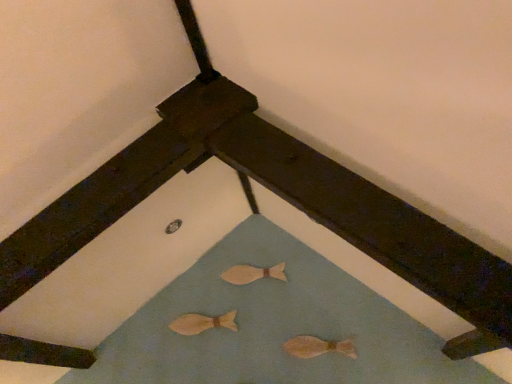
Question: Can you confirm if wooden fish at center, the 1th animal when ordered from left to right, is thinner than wooden fish at center, acting as the third animal starting from the bottom?

Choices:
 (A) yes
 (B) no

Answer: (B)

Question: Could you tell me if wooden fish at center, the second animal positioned from the back, is turned towards wooden fish at center, the 1th animal from the back?

Choices:
 (A) no
 (B) yes

Answer: (A)

Question: From a real-world perspective, is wooden fish at center, arranged as the second animal when viewed from the top, on top of wooden fish at center, placed as the 1th animal when sorted from top to bottom?

Choices:
 (A) no
 (B) yes

Answer: (A)

Question: Does wooden fish at center, which is counted as the third animal, starting from the right, have a greater height compared to wooden fish at center, acting as the third animal starting from the bottom?

Choices:
 (A) no
 (B) yes

Answer: (B)

Question: From the image's perspective, is wooden fish at center, the second animal positioned from the back, on wooden fish at center, which is the 2th animal from left to right?

Choices:
 (A) no
 (B) yes

Answer: (A)

Question: Does point (273, 274) appear closer or farther from the camera than point (181, 319)?

Choices:
 (A) closer
 (B) farther

Answer: (B)

Question: From a real-world perspective, is wooden fish at center, placed as the 1th animal when sorted from top to bottom, above or below wooden fish at center, which is counted as the third animal, starting from the right?

Choices:
 (A) below
 (B) above

Answer: (B)

Question: Considering the positions of wooden fish at center, placed as the 1th animal when sorted from top to bottom, and wooden fish at center, the 2th animal positioned from the bottom, in the image, is wooden fish at center, placed as the 1th animal when sorted from top to bottom, wider or thinner than wooden fish at center, the 2th animal positioned from the bottom,?

Choices:
 (A) thin
 (B) wide

Answer: (A)

Question: Looking at the image, does wooden fish at center, acting as the third animal starting from the front, seem bigger or smaller compared to wooden fish at center, the 1th animal when ordered from left to right?

Choices:
 (A) small
 (B) big

Answer: (A)

Question: Looking at their shapes, would you say wooden fish at center, which is the 2th animal from left to right, is wider or thinner than light brown wooden fish at lower center, which appears as the first animal when ordered from the bottom?

Choices:
 (A) thin
 (B) wide

Answer: (A)

Question: Is wooden fish at center, acting as the third animal starting from the front, taller or shorter than light brown wooden fish at lower center, which appears as the first animal when ordered from the bottom?

Choices:
 (A) tall
 (B) short

Answer: (B)

Question: In the image, is wooden fish at center, which is the 2th animal from left to right, positioned in front of or behind light brown wooden fish at lower center, placed as the third animal when sorted from top to bottom?

Choices:
 (A) front
 (B) behind

Answer: (B)

Question: Is point (253, 276) closer or farther from the camera than point (315, 339)?

Choices:
 (A) farther
 (B) closer

Answer: (A)

Question: From a real-world perspective, relative to wooden fish at center, the 2th animal in the right-to-left sequence, is light brown wooden fish at lower center, which appears as the third animal when viewed from the back, vertically above or below?

Choices:
 (A) above
 (B) below

Answer: (B)

Question: In terms of height, does light brown wooden fish at lower center, which is counted as the 1th animal, starting from the front, look taller or shorter compared to wooden fish at center, the 2th animal in the right-to-left sequence?

Choices:
 (A) short
 (B) tall

Answer: (B)